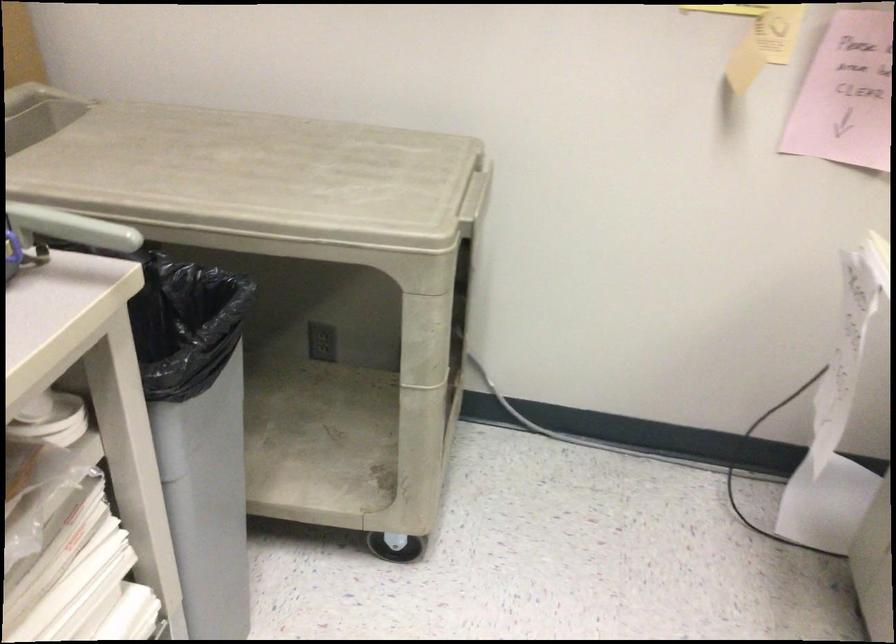
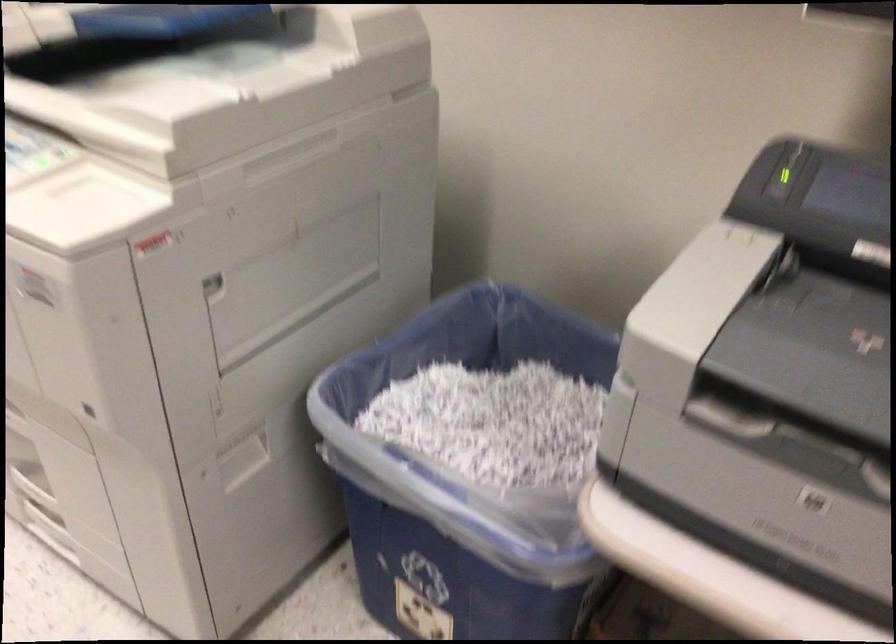
Question: In a continuous first-person perspective shot, in which direction is the camera moving?

Choices:
 (A) Left
 (B) Right
 (C) Forward
 (D) Backward

Answer: (D)